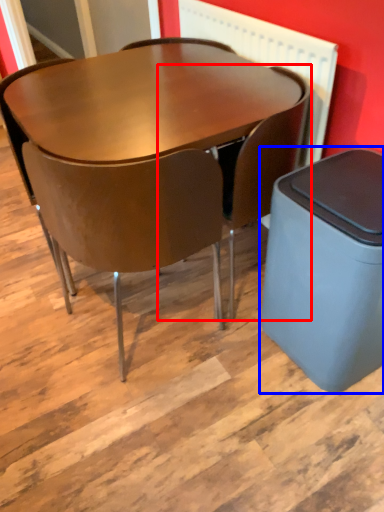
Question: Which point is closer to the camera, chair (highlighted by a red box) or waste container (highlighted by a blue box)?

Choices:
 (A) chair
 (B) waste container

Answer: (B)